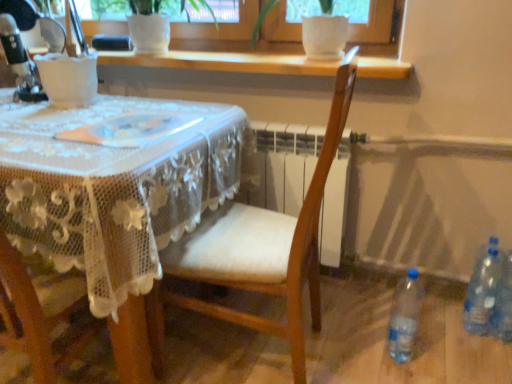
You are a GUI agent. You are given a task and a screenshot of the screen. Output one action in this format:
    pyautogui.click(x=<x>, y=<y>)
    Task: Click on the vacant area located to the right-hand side of transparent plastic bottle at lower right, the 3th bottle when ordered from right to left
    This screenshot has height=384, width=512.
    Given the screenshot: What is the action you would take?
    tap(441, 354)